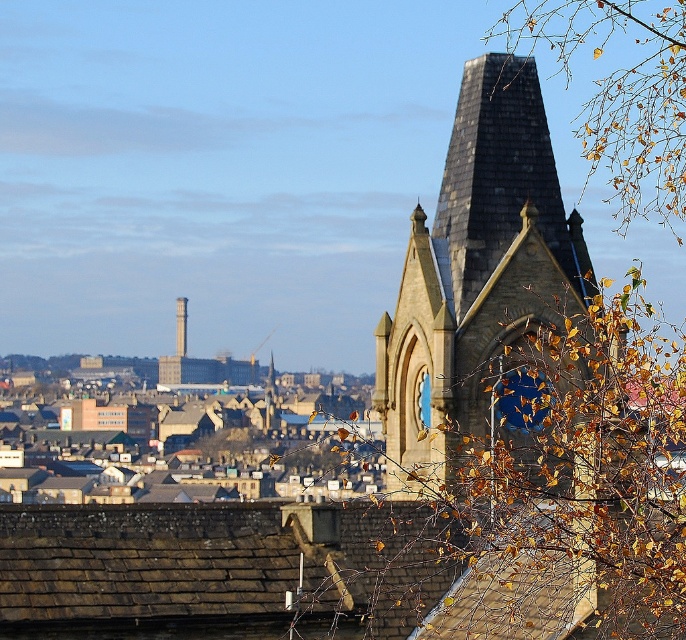
You are standing in a city park and see two points in the distance. The first point is at coordinates point (654, 524) and the second point is at point (185, 324). Which point is nearer to you?

Point (654, 524) is closer to the camera than point (185, 324), so the first point is nearer to you.

You are standing in the city park and see the golden leafy branch at upper right and the light gray stone bell tower at center. Which object is positioned more to the east if the sun is setting in the west?

The golden leafy branch at upper right is positioned more to the east because it is to the right of the light gray stone bell tower at center, and since the sun is setting in the west, the right side of the image corresponds to the east direction.

You are an architect analyzing the cityscape. You notice the blue glass clock at upper center. What are its coordinates in the image?

The blue glass clock at upper center is located at coordinates (423, 400).